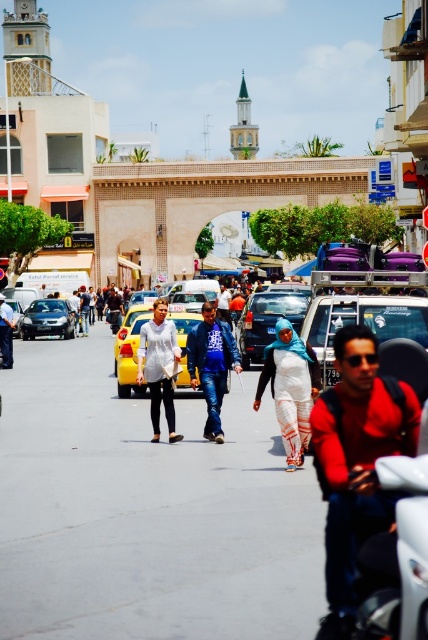
Question: Estimate the real-world distances between objects in this image. Which object is closer to the matte blue jeans at center?

Choices:
 (A) white fabric jacket at center
 (B) red matte shirt at center
 (C) blue denim jeans at center
 (D) yellow matte taxi at center

Answer: (D)

Question: Which point is farther to the camera?

Choices:
 (A) (220, 428)
 (B) (53, 308)
 (C) (261, 316)

Answer: (B)

Question: Does white cotton dress at center appear over matte blue jeans at center?

Choices:
 (A) no
 (B) yes

Answer: (A)

Question: In this image, where is red matte shirt at center located relative to white cotton dress at center?

Choices:
 (A) right
 (B) left

Answer: (A)

Question: Which point is farther from the camera taking this photo?

Choices:
 (A) (318, 305)
 (B) (65, 307)

Answer: (B)

Question: Considering the relative positions of white cotton dress at center and matte blue jeans at center in the image provided, where is white cotton dress at center located with respect to matte blue jeans at center?

Choices:
 (A) right
 (B) left

Answer: (A)